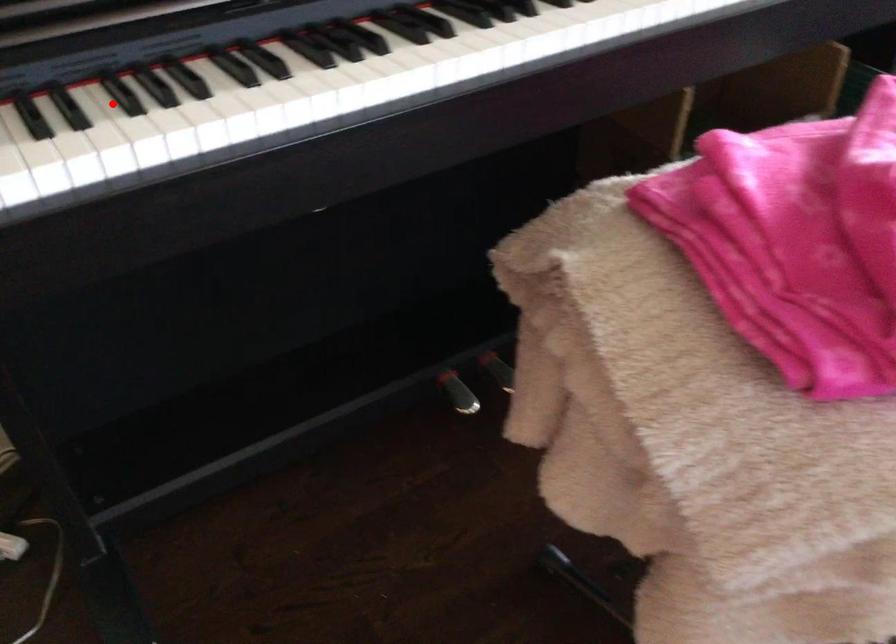
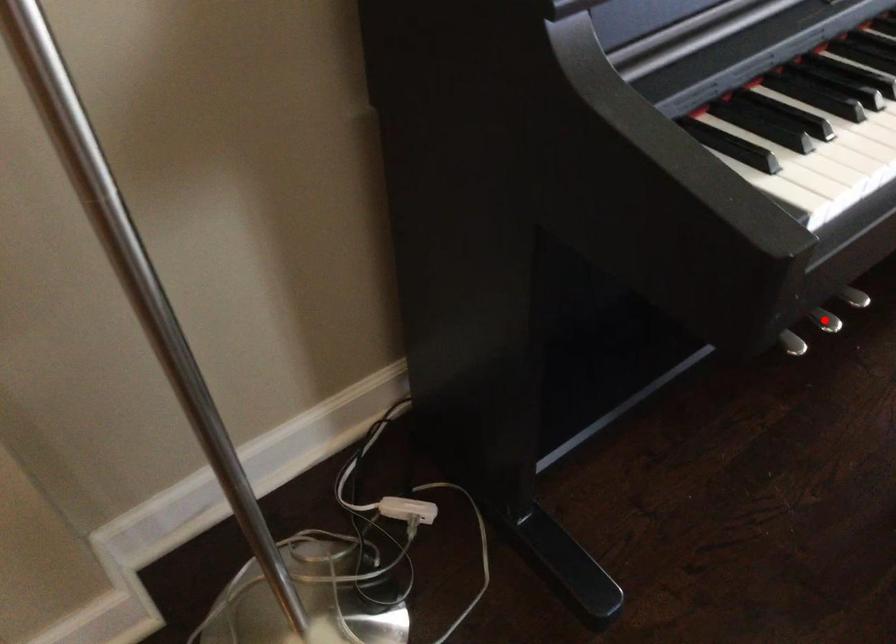
I am providing you with two images of the same scene from different viewpoints. A red point is marked on the first image and another point is marked on the second image. Do the highlighted points in image1 and image2 indicate the same real-world spot?

No